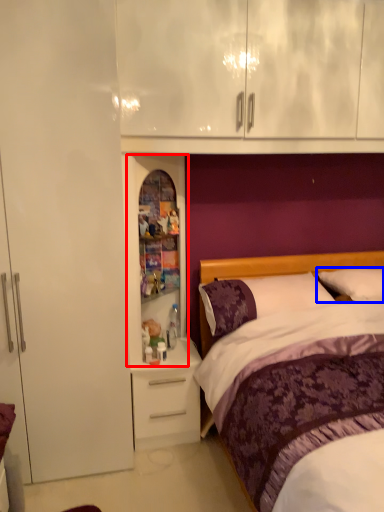
Question: Among these objects, which one is nearest to the camera, medicine cabinet (highlighted by a red box) or pillow (highlighted by a blue box)?

Choices:
 (A) medicine cabinet
 (B) pillow

Answer: (A)